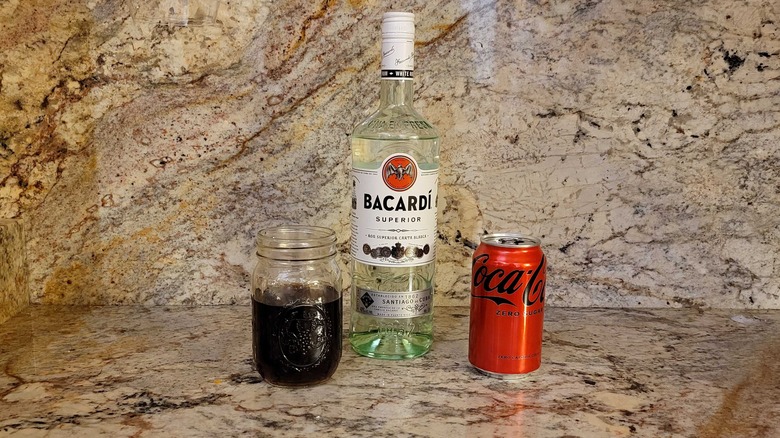
Identify the location of table. The height and width of the screenshot is (438, 780). (608, 335).